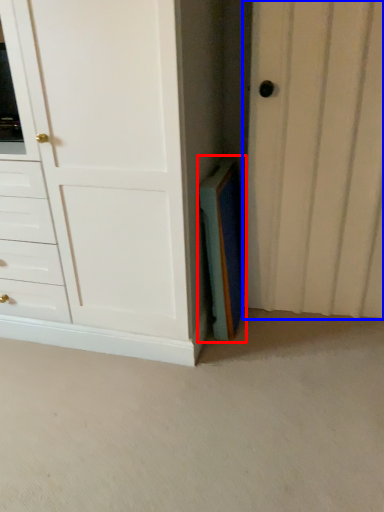
Question: Which point is further to the camera, paperback book (highlighted by a red box) or door (highlighted by a blue box)?

Choices:
 (A) paperback book
 (B) door

Answer: (A)